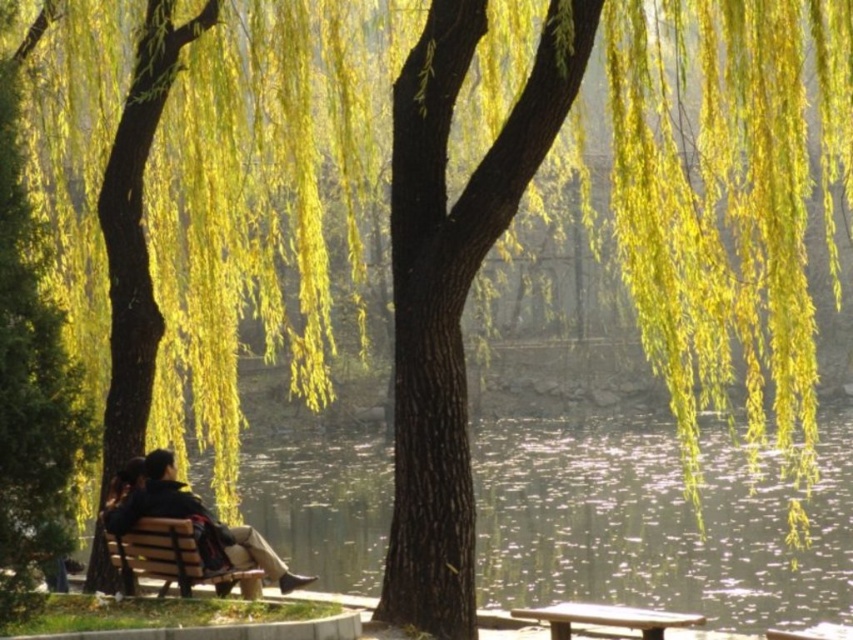
You are a visitor at this peaceful park scene. You see the wooden bench at center and the wooden park bench at center. Which one is higher in position?

The wooden bench at center is located above the wooden park bench at center, so it is higher in position.

You are a visitor at this park and want to sit on the wooden park bench at center. Which direction should you walk from the dark brown leather bench at lower left to reach it?

You should walk towards the direction away from the viewer because the wooden park bench at center is closer to the viewer than the dark brown leather bench at lower left, so moving away from the viewer would lead you towards it.

You are planning to host a small gathering for two people. Which of the two benches, the dark brown leather bench at lower left or the wooden park bench at center, would be more suitable for seating them comfortably?

The wooden park bench at center is more suitable for seating two people comfortably because it is larger than the dark brown leather bench at lower left.